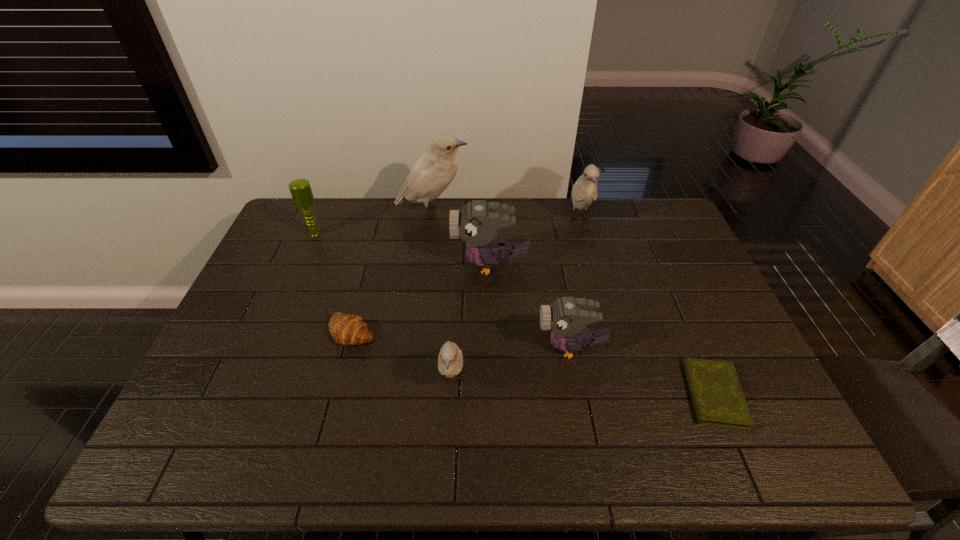
You are a GUI agent. You are given a task and a screenshot of the screen. Output one action in this format:
    pyautogui.click(x=<x>, y=<y>)
    Task: Click on the vacant space located at the beak of the nearer gray bird
    The width and height of the screenshot is (960, 540).
    Given the screenshot: What is the action you would take?
    (450, 348)

In order to click on vacant space located at the beak of the nearer gray bird in this screenshot , I will do `click(518, 348)`.

At what (x,y) coordinates should I click in order to perform the action: click on free location located on the left of the seventh tallest object. Please return your answer as a coordinate pair (x, y). Looking at the image, I should click on (300, 331).

Where is `free space located on the left of the rightmost object`? The image size is (960, 540). free space located on the left of the rightmost object is located at coordinates (540, 394).

Find the location of a particular element. The image size is (960, 540). microphone positioned at the far edge is located at coordinates (300, 189).

This screenshot has height=540, width=960. Find the location of `object that is at the near edge`. object that is at the near edge is located at coordinates [718, 399].

In order to click on object at the left edge in this screenshot , I will do `click(300, 189)`.

The image size is (960, 540). Find the location of `object positioned at the right edge`. object positioned at the right edge is located at coordinates (718, 399).

Where is `object that is at the far left corner`? This screenshot has height=540, width=960. object that is at the far left corner is located at coordinates (300, 189).

Identify the location of object at the near right corner. (x=718, y=399).